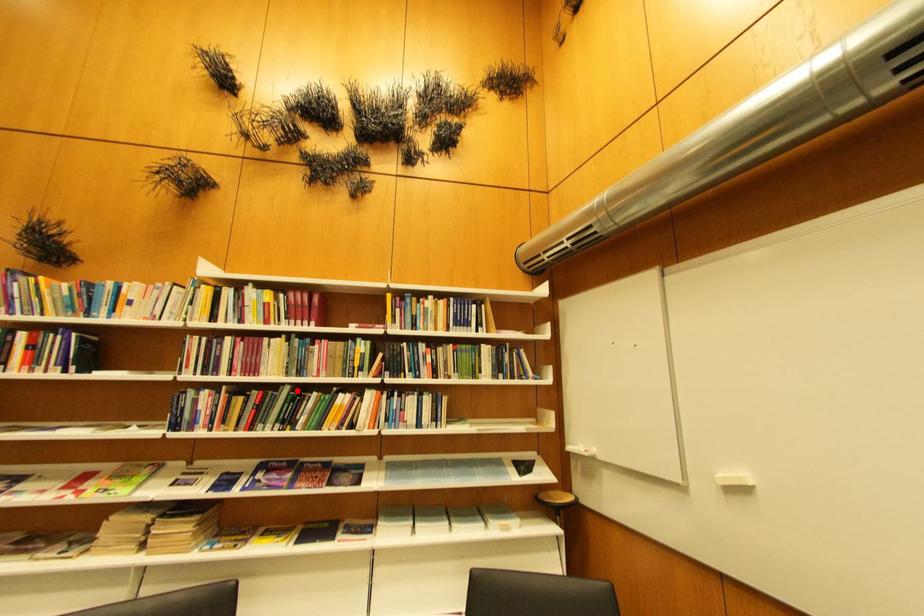
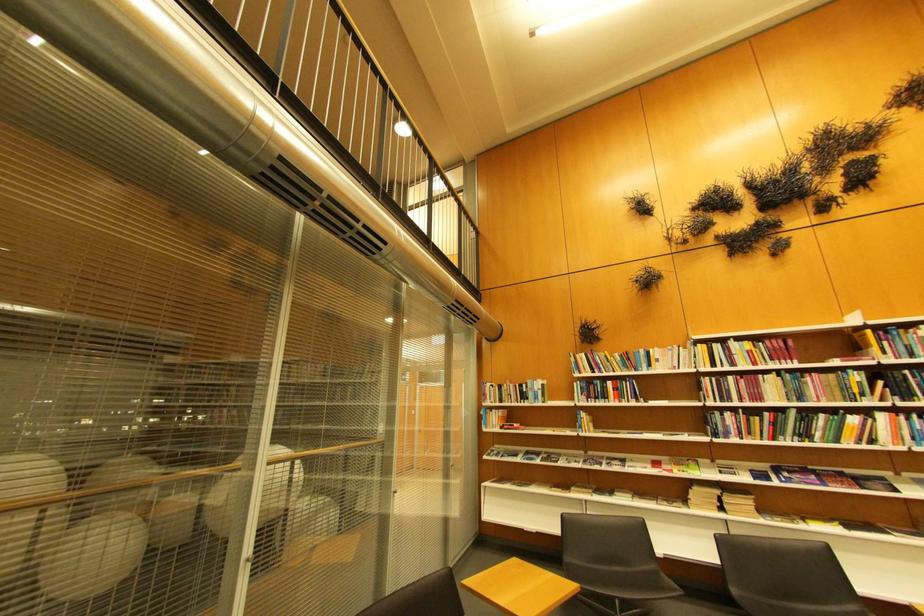
Where in the second image is the point corresponding to the highlighted location from the first image?

(804, 413)